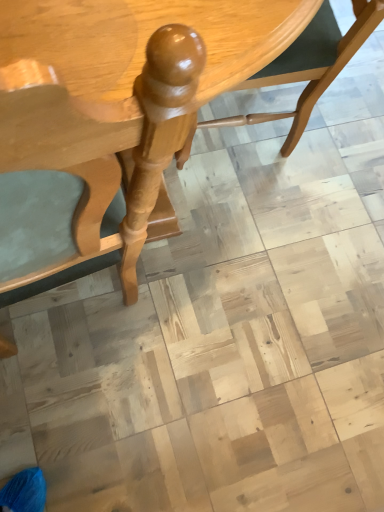
Question: Looking at the image, does glossy wood table at center seem bigger or smaller compared to glossy wood chair at center?

Choices:
 (A) big
 (B) small

Answer: (A)

Question: In the image, is glossy wood table at center on the left side or the right side of glossy wood chair at center?

Choices:
 (A) right
 (B) left

Answer: (B)

Question: From the image's perspective, is glossy wood table at center located above or below glossy wood chair at center?

Choices:
 (A) above
 (B) below

Answer: (B)

Question: Looking at the image, does glossy wood chair at center seem bigger or smaller compared to glossy wood table at center?

Choices:
 (A) big
 (B) small

Answer: (B)

Question: Is glossy wood chair at center spatially inside glossy wood table at center, or outside of it?

Choices:
 (A) outside
 (B) inside

Answer: (B)

Question: From a real-world perspective, relative to glossy wood table at center, is glossy wood chair at center vertically above or below?

Choices:
 (A) below
 (B) above

Answer: (A)

Question: From the image's perspective, relative to glossy wood table at center, is glossy wood chair at center above or below?

Choices:
 (A) below
 (B) above

Answer: (B)